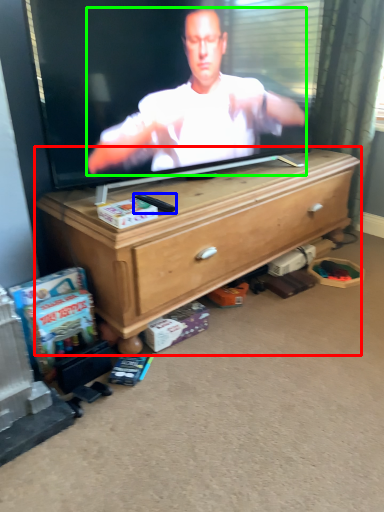
Question: Which object is the farthest from chest of drawers (highlighted by a red box)? Choose among these: remote control (highlighted by a blue box) or person (highlighted by a green box).

Choices:
 (A) remote control
 (B) person

Answer: (A)